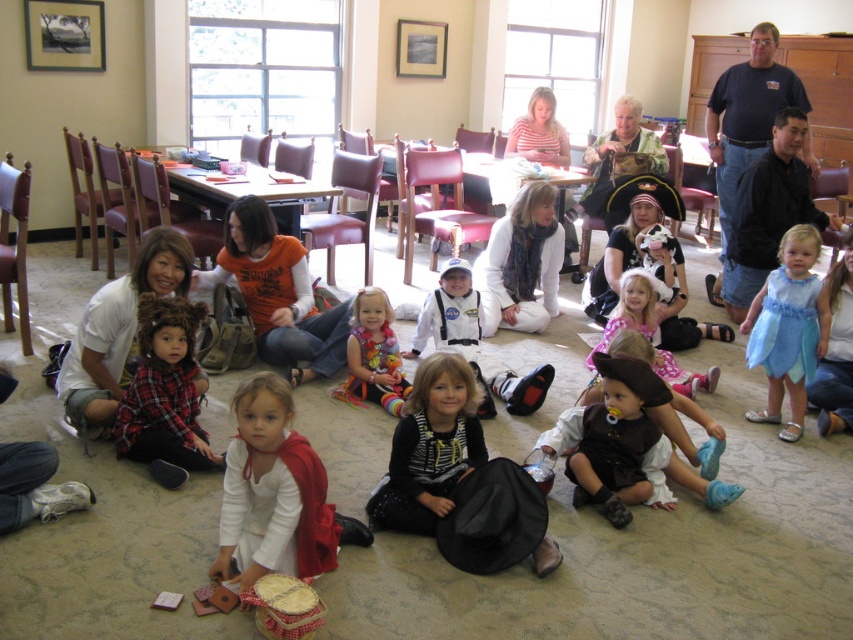
From the picture: Which is more to the left, light blue satin dress at lower right or dark blue t-shirt at upper right?

Positioned to the left is light blue satin dress at lower right.

Is light blue satin dress at lower right taller than dark blue t-shirt at upper right?

In fact, light blue satin dress at lower right may be shorter than dark blue t-shirt at upper right.

Where is `light blue satin dress at lower right`? This screenshot has height=640, width=853. light blue satin dress at lower right is located at coordinates (788, 328).

You are a GUI agent. You are given a task and a screenshot of the screen. Output one action in this format:
    pyautogui.click(x=<x>, y=<y>)
    Task: Click on the light blue satin dress at lower right
    
    Given the screenshot: What is the action you would take?
    (788, 328)

Does fluffy multicolored sweater at center come behind matte pink dress at center?

No.

Between fluffy multicolored sweater at center and matte pink dress at center, which one appears on the right side from the viewer's perspective?

From the viewer's perspective, matte pink dress at center appears more on the right side.

Which is in front, point (381, 388) or point (685, 396)?

Point (381, 388) is in front.

Locate an element on the screen. The width and height of the screenshot is (853, 640). fluffy multicolored sweater at center is located at coordinates (373, 355).

Does space suit at center have a smaller size compared to matte pink dress at center?

Actually, space suit at center might be larger than matte pink dress at center.

Is space suit at center further to the viewer compared to matte pink dress at center?

No, it is not.

Which is in front, point (502, 388) or point (628, 269)?

Point (502, 388) is more forward.

Identify the location of space suit at center. The width and height of the screenshot is (853, 640). (474, 342).